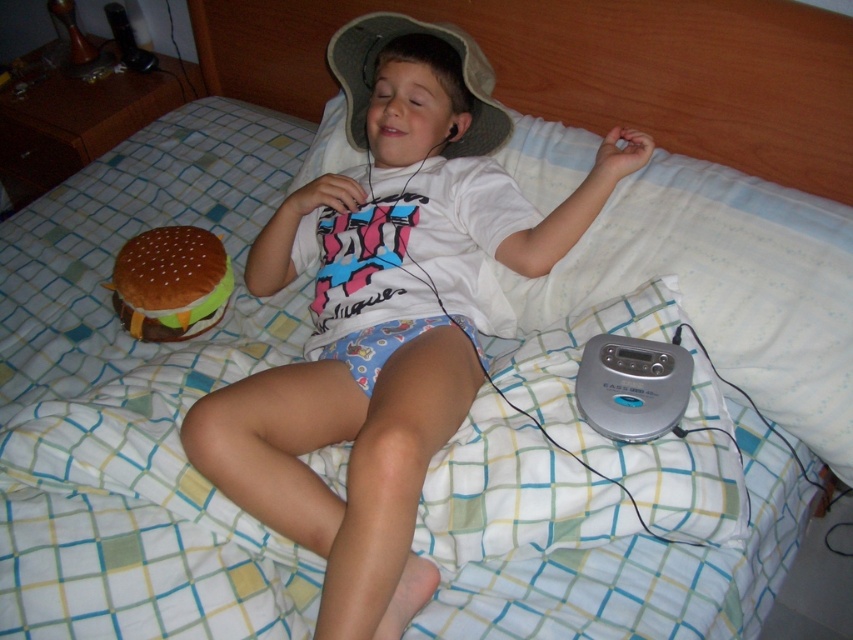
Question: Which point is closer to the camera taking this photo?

Choices:
 (A) (180, 337)
 (B) (373, 214)

Answer: (B)

Question: Is white cotton shirt at center to the left of brown plush/hairy hamburger at left from the viewer's perspective?

Choices:
 (A) no
 (B) yes

Answer: (A)

Question: Is white cotton shirt at center smaller than gray fabric baseball hat at center?

Choices:
 (A) yes
 (B) no

Answer: (B)

Question: Does white cotton shirt at center appear over gray fabric baseball hat at center?

Choices:
 (A) no
 (B) yes

Answer: (A)

Question: Which point is closer to the camera?

Choices:
 (A) (477, 145)
 (B) (177, 308)
 (C) (387, 342)

Answer: (C)

Question: Which object is farther from the camera taking this photo?

Choices:
 (A) brown plush/hairy hamburger at left
 (B) gray fabric baseball hat at center

Answer: (A)